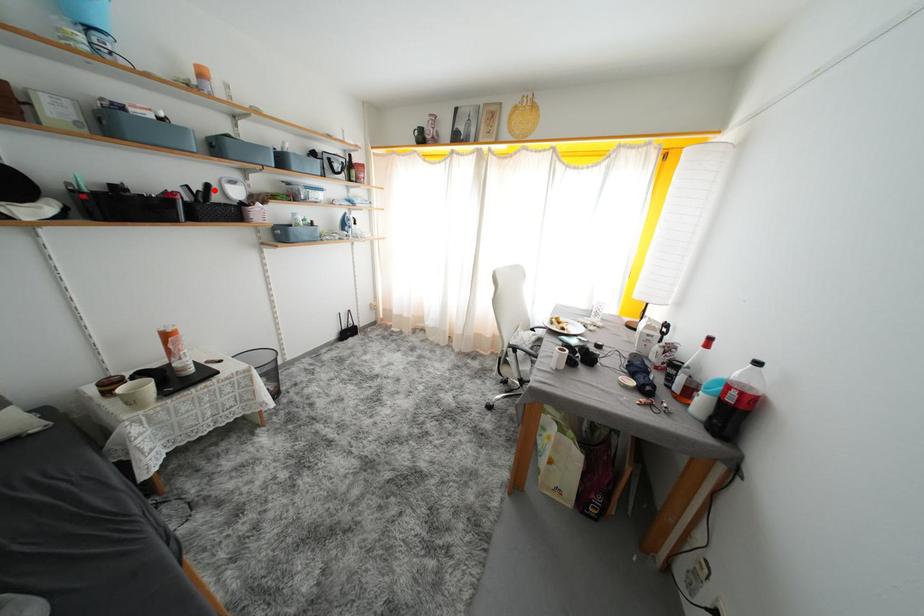
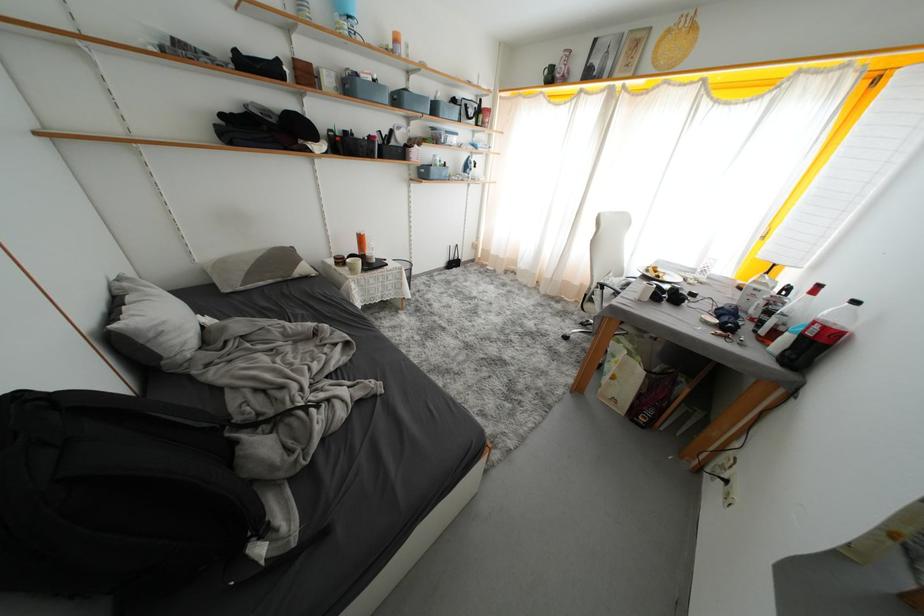
In the second image, find the point that corresponds to the highlighted location in the first image.

(397, 136)